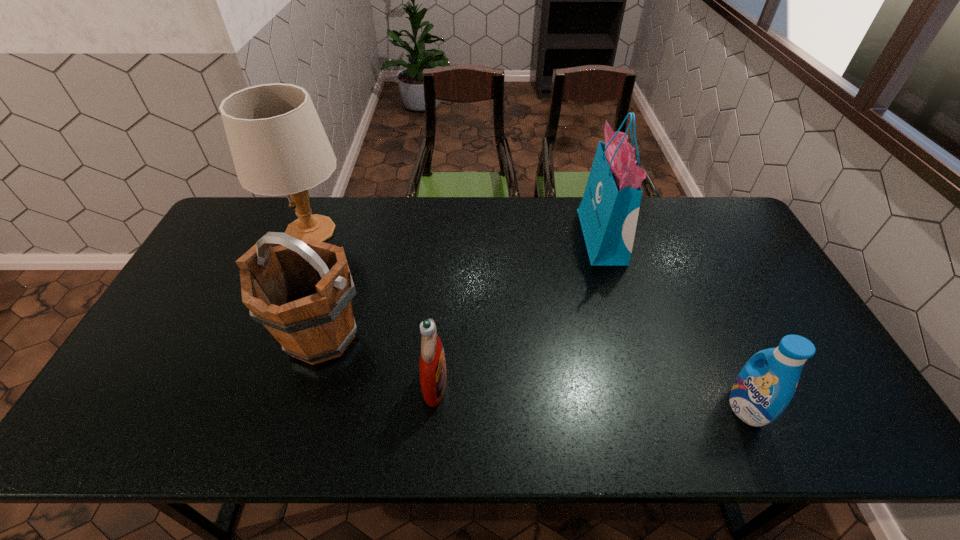
Where is `vacant area at the near right corner`? The height and width of the screenshot is (540, 960). vacant area at the near right corner is located at coordinates (818, 442).

I want to click on empty space that is in between the fourth object from left to right and the left detergent, so click(x=518, y=310).

You are a GUI agent. You are given a task and a screenshot of the screen. Output one action in this format:
    pyautogui.click(x=<x>, y=<y>)
    Task: Click on the free spot between the rightmost object and the third object from right to left
    
    Given the screenshot: What is the action you would take?
    pyautogui.click(x=590, y=396)

Identify the location of free space between the third object from left to right and the third tallest object. (378, 360).

The image size is (960, 540). What are the coordinates of `vacant area that lies between the second object from right to left and the table lamp` in the screenshot? It's located at (456, 234).

In order to click on vacant space in between the third shortest object and the third object from left to right in this screenshot , I will do `click(378, 360)`.

I want to click on free spot between the right detergent and the bucket, so click(x=534, y=372).

Where is `free spot between the third object from right to left and the shopping bag`? This screenshot has width=960, height=540. free spot between the third object from right to left and the shopping bag is located at coordinates (518, 310).

Choose which object is the fourth nearest neighbor to the bucket. Please provide its 2D coordinates. Your answer should be formatted as a tuple, i.e. [(x, y)], where the tuple contains the x and y coordinates of a point satisfying the conditions above.

[(760, 393)]

Locate an element on the screen. The image size is (960, 540). the second closest object to the shopping bag is located at coordinates (432, 366).